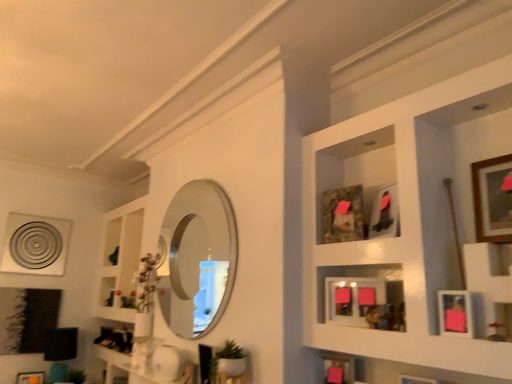
Question: Does camouflage fabric picture frame at center, which ranks as the 6th picture frame in right-to-left order, appear on the left side of pink matte picture frame at lower right, the 7th picture frame viewed from the back?

Choices:
 (A) yes
 (B) no

Answer: (A)

Question: Can we say camouflage fabric picture frame at center, which ranks as the 6th picture frame in front-to-back order, lies outside pink matte picture frame at lower right, the 7th picture frame viewed from the back?

Choices:
 (A) no
 (B) yes

Answer: (B)

Question: Could you tell me if camouflage fabric picture frame at center, which is the third picture frame in left-to-right order, is facing pink matte picture frame at lower right, marked as the 7th picture frame in a left-to-right arrangement?

Choices:
 (A) no
 (B) yes

Answer: (A)

Question: Is camouflage fabric picture frame at center, the third picture frame when ordered from top to bottom, to the right of pink matte picture frame at lower right, which is the 2th picture frame in front-to-back order, from the viewer's perspective?

Choices:
 (A) yes
 (B) no

Answer: (B)

Question: Considering the relative sizes of camouflage fabric picture frame at center, which ranks as the 6th picture frame in front-to-back order, and pink matte picture frame at lower right, the fourth picture frame in the top-to-bottom sequence, in the image provided, is camouflage fabric picture frame at center, which ranks as the 6th picture frame in front-to-back order, shorter than pink matte picture frame at lower right, the fourth picture frame in the top-to-bottom sequence,?

Choices:
 (A) yes
 (B) no

Answer: (B)

Question: Considering the positions of point (25, 372) and point (415, 269), is point (25, 372) closer or farther from the camera than point (415, 269)?

Choices:
 (A) closer
 (B) farther

Answer: (B)

Question: Looking at their shapes, would you say matte orange picture frame at lower left, the seventh picture frame when ordered from right to left, is wider or thinner than wooden picture frames at upper right?

Choices:
 (A) wide
 (B) thin

Answer: (B)

Question: In terms of height, does matte orange picture frame at lower left, the eighth picture frame positioned from the top, look taller or shorter compared to wooden picture frames at upper right?

Choices:
 (A) short
 (B) tall

Answer: (A)

Question: Is matte orange picture frame at lower left, which is the 2th picture frame in left-to-right order, situated inside wooden picture frames at upper right or outside?

Choices:
 (A) inside
 (B) outside

Answer: (B)

Question: From their relative heights in the image, would you say polished silver mirror at center is taller or shorter than wooden framed picture at upper right, the first picture frame from the right?

Choices:
 (A) short
 (B) tall

Answer: (B)

Question: Is polished silver mirror at center in front of or behind wooden framed picture at upper right, which is counted as the 8th picture frame, starting from the left, in the image?

Choices:
 (A) front
 (B) behind

Answer: (B)

Question: Looking at their shapes, would you say polished silver mirror at center is wider or thinner than wooden framed picture at upper right, which appears as the 1th picture frame when viewed from the top?

Choices:
 (A) wide
 (B) thin

Answer: (A)

Question: From the image's perspective, is polished silver mirror at center above or below wooden framed picture at upper right, which is counted as the 8th picture frame, starting from the left?

Choices:
 (A) below
 (B) above

Answer: (A)

Question: Would you say matte orange picture frame at lower left, arranged as the 2th picture frame when viewed from the back, is inside or outside pink matte picture frame at lower right, the 7th picture frame viewed from the back?

Choices:
 (A) outside
 (B) inside

Answer: (A)

Question: From a real-world perspective, is matte orange picture frame at lower left, the eighth picture frame positioned from the top, above or below pink matte picture frame at lower right, the fourth picture frame in the top-to-bottom sequence?

Choices:
 (A) below
 (B) above

Answer: (A)